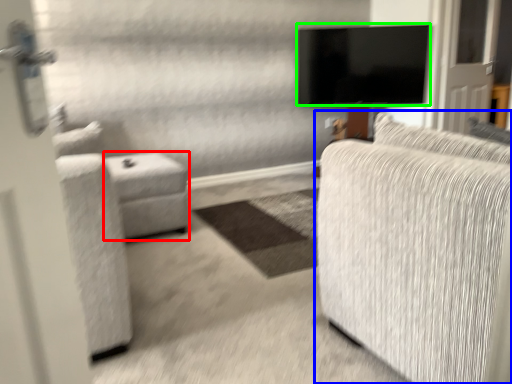
Question: Which object is positioned closest to table (highlighted by a red box)? Select from studio couch (highlighted by a blue box) and television (highlighted by a green box).

Choices:
 (A) studio couch
 (B) television

Answer: (A)